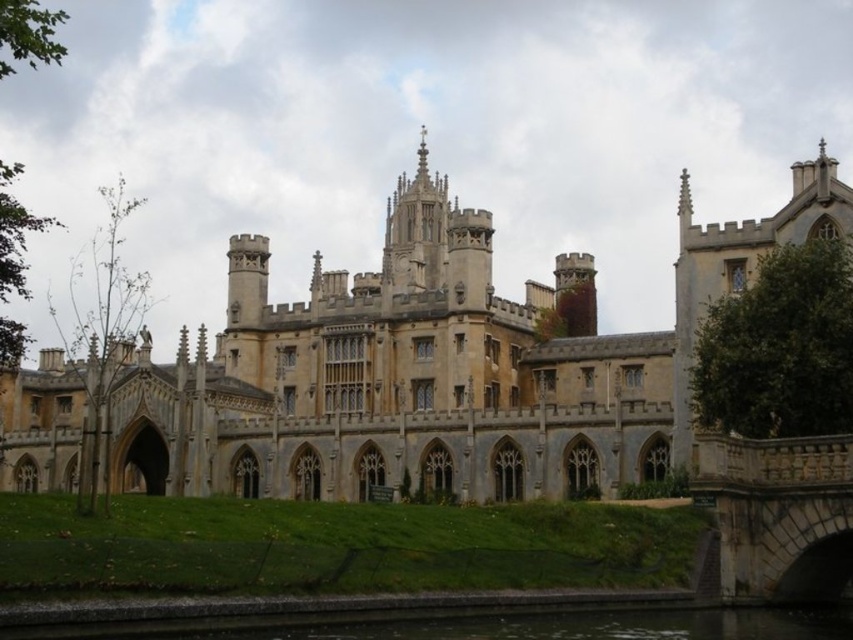
Question: Can you confirm if stone textured bridge at lower right is positioned to the left of green concrete river at lower center?

Choices:
 (A) yes
 (B) no

Answer: (B)

Question: Is stone textured bridge at lower right positioned before green concrete river at lower center?

Choices:
 (A) yes
 (B) no

Answer: (B)

Question: Which object appears farthest from the camera in this image?

Choices:
 (A) green concrete river at lower center
 (B) stone textured bridge at lower right

Answer: (B)

Question: Which of the following is the farthest from the observer?

Choices:
 (A) stone textured bridge at lower right
 (B) beige stone castle at center

Answer: (B)

Question: Does beige stone castle at center have a lesser width compared to stone textured bridge at lower right?

Choices:
 (A) no
 (B) yes

Answer: (A)

Question: Which point is closer to the camera?

Choices:
 (A) beige stone castle at center
 (B) green concrete river at lower center
 (C) stone textured bridge at lower right

Answer: (B)